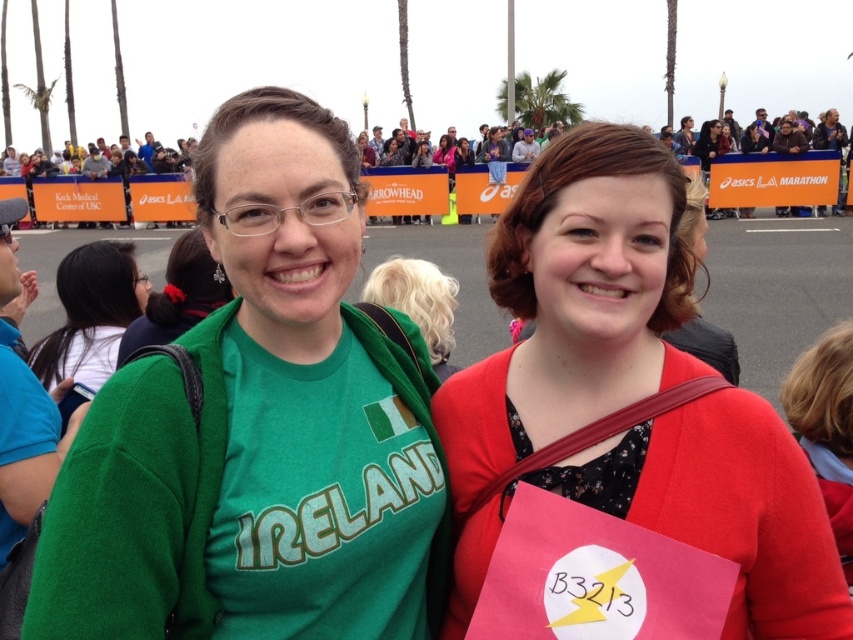
Question: Can you confirm if green cotton shirt at center is bigger than matte red cardigan at center?

Choices:
 (A) yes
 (B) no

Answer: (A)

Question: Which object appears closest to the camera in this image?

Choices:
 (A) green fabric shirt at center
 (B) green fabric at center
 (C) matte red cardigan at center
 (D) green cotton shirt at center

Answer: (D)

Question: Which of the following is the closest to the observer?

Choices:
 (A) matte red cardigan at center
 (B) green fabric shirt at center
 (C) green fabric at center
 (D) green cotton shirt at center

Answer: (D)

Question: Which point is closer to the camera taking this photo?

Choices:
 (A) (73, 371)
 (B) (270, 573)

Answer: (B)

Question: In this image, where is green cotton shirt at center located relative to matte red cardigan at center?

Choices:
 (A) below
 (B) above

Answer: (B)

Question: Does green cotton shirt at center come in front of green fabric at center?

Choices:
 (A) yes
 (B) no

Answer: (A)